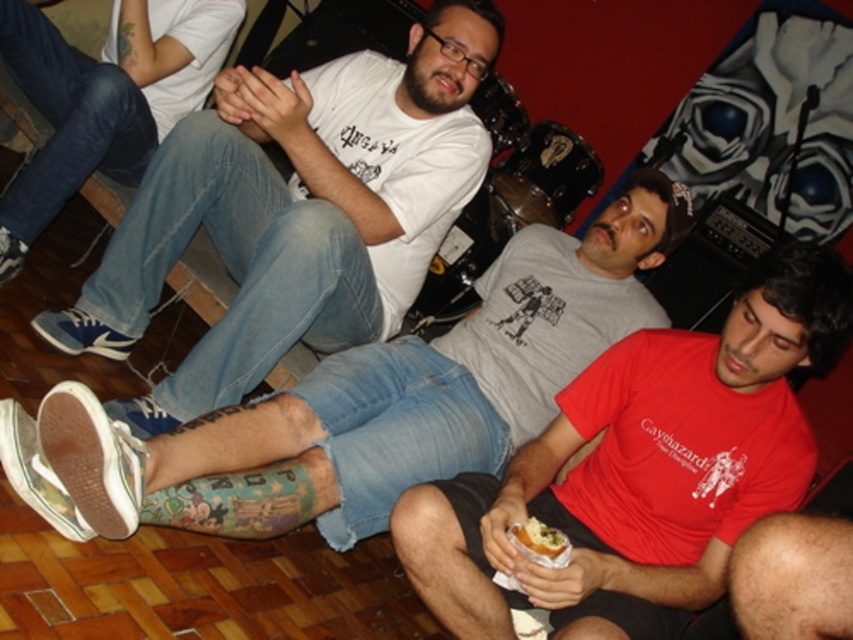
You are standing at point [22,76] and want to move to the back of the scene. Which direction should you move relative to point [579,353]?

To move to the back of the scene from point [22,76], you should move behind point [579,353] since it is in front of you.